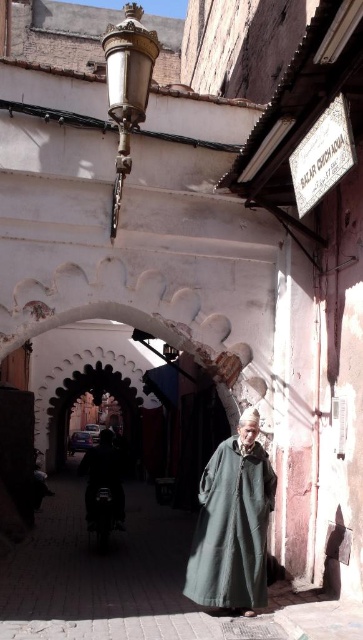
Question: Among these objects, which one is farthest from the camera?

Choices:
 (A) dark green fabric at center
 (B) dark blue fabric at center

Answer: (B)

Question: Which of the following is the closest to the observer?

Choices:
 (A) dark blue fabric at center
 (B) dark green fabric at center

Answer: (B)

Question: Where is dark green fabric at center located in relation to dark blue fabric at center in the image?

Choices:
 (A) above
 (B) below

Answer: (A)

Question: Is dark green fabric at center thinner than dark blue fabric at center?

Choices:
 (A) no
 (B) yes

Answer: (B)

Question: Can you confirm if dark green fabric at center is wider than dark blue fabric at center?

Choices:
 (A) yes
 (B) no

Answer: (B)

Question: Among these points, which one is nearest to the camera?

Choices:
 (A) (207, 516)
 (B) (109, 484)

Answer: (A)